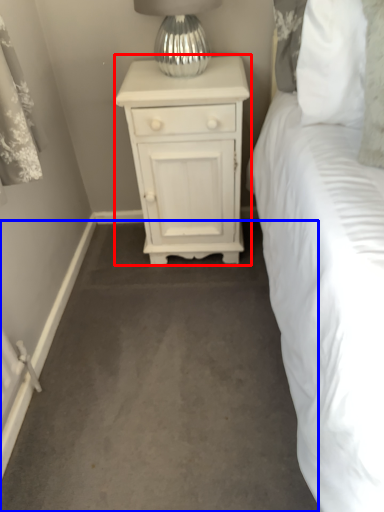
Question: Which of the following is the closest to the observer, nightstand (highlighted by a red box) or concrete (highlighted by a blue box)?

Choices:
 (A) nightstand
 (B) concrete

Answer: (B)